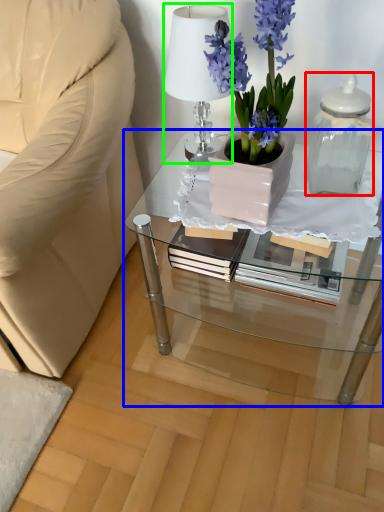
Question: Which object is positioned farthest from bottle (highlighted by a red box)? Select from table (highlighted by a blue box) and lamp (highlighted by a green box).

Choices:
 (A) table
 (B) lamp

Answer: (B)